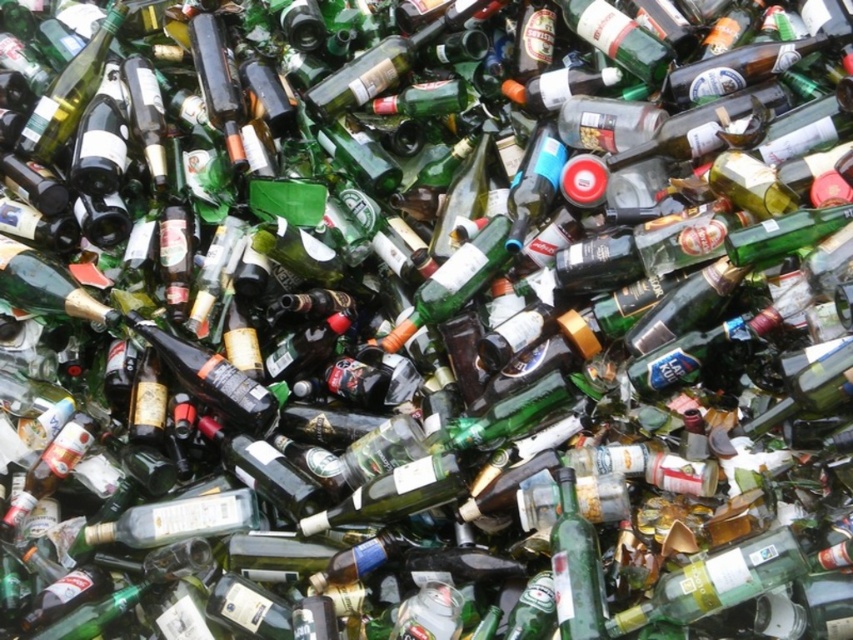
You are standing in front of a pile of glass bottles. You see a green glass bottle at center and a matte black bottle at center. Which one is closer to you?

The green glass bottle at center is closer to the viewer than the matte black bottle at center.

You are organizing a recycling event and need to sort bottles by size. You have a green glass bottle at center and a matte black bottle at center. Which bottle should you place in the larger size bin?

The matte black bottle at center should be placed in the larger size bin since it has a greater width than the green glass bottle at center.